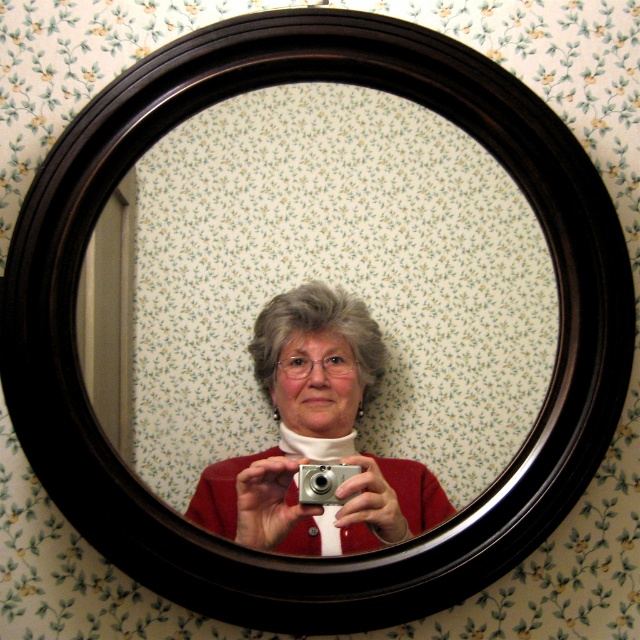
Consider the image. Who is positioned more to the left, black wood mirror at center or matte silver camera at center?

matte silver camera at center is more to the left.

Can you confirm if black wood mirror at center is thinner than matte silver camera at center?

In fact, black wood mirror at center might be wider than matte silver camera at center.

Is point (324, 88) closer to viewer compared to point (342, 374)?

No, it is not.

Locate an element on the screen. black wood mirror at center is located at coordinates [x=321, y=282].

Between matte silver camera at center and silver metallic camera at center, which one is positioned higher?

matte silver camera at center is higher up.

You are a GUI agent. You are given a task and a screenshot of the screen. Output one action in this format:
    pyautogui.click(x=<x>, y=<y>)
    Task: Click on the matte silver camera at center
    Image resolution: width=640 pixels, height=640 pixels.
    Given the screenshot: What is the action you would take?
    pyautogui.click(x=316, y=436)

Does black wood mirror at center appear on the right side of silver metallic camera at center?

Incorrect, black wood mirror at center is not on the right side of silver metallic camera at center.

Does point (442, 163) come closer to viewer compared to point (308, 470)?

No, it is behind (308, 470).

Between point (138, 209) and point (310, 493), which one is positioned in front?

Positioned in front is point (310, 493).

Locate an element on the screen. This screenshot has height=640, width=640. black wood mirror at center is located at coordinates (321, 282).